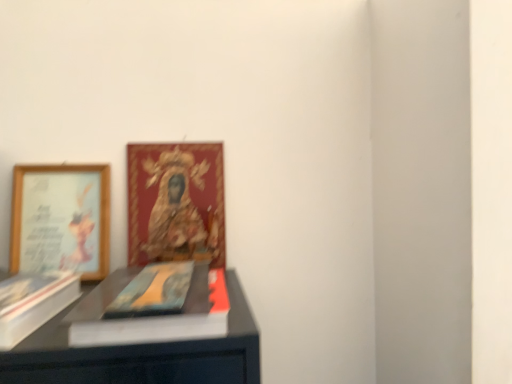
Question: Is gold-framed picture at upper left, which is the 2th picture frame from left to right, facing away from white matte paperback book at left?

Choices:
 (A) yes
 (B) no

Answer: (B)

Question: Could you tell me if gold-framed picture at upper left, which is the 2th picture frame from left to right, is turned towards white matte paperback book at left?

Choices:
 (A) no
 (B) yes

Answer: (A)

Question: Is gold-framed picture at upper left, which is the 2th picture frame from left to right, next to white matte paperback book at left?

Choices:
 (A) no
 (B) yes

Answer: (A)

Question: Is gold-framed picture at upper left, which appears as the first picture frame when viewed from the right, closer to camera compared to white matte paperback book at left?

Choices:
 (A) no
 (B) yes

Answer: (A)

Question: Is gold-framed picture at upper left, which is the 2th picture frame from left to right, far from white matte paperback book at left?

Choices:
 (A) yes
 (B) no

Answer: (B)

Question: From a real-world perspective, is gold-framed picture at upper left, which is the 2th picture frame from left to right, located higher than white matte paperback book at left?

Choices:
 (A) yes
 (B) no

Answer: (A)

Question: Considering the relative positions of gold-framed picture at upper left, which appears as the first picture frame when viewed from the right, and wooden framed picture at left, which appears as the second picture frame when viewed from the right, in the image provided, is gold-framed picture at upper left, which appears as the first picture frame when viewed from the right, to the right of wooden framed picture at left, which appears as the second picture frame when viewed from the right, from the viewer's perspective?

Choices:
 (A) no
 (B) yes

Answer: (B)

Question: From a real-world perspective, is gold-framed picture at upper left, which appears as the first picture frame when viewed from the right, located higher than wooden framed picture at left, which appears as the second picture frame when viewed from the right?

Choices:
 (A) no
 (B) yes

Answer: (B)

Question: Are gold-framed picture at upper left, which is the 2th picture frame from left to right, and wooden framed picture at left, the first picture frame viewed from the left, far apart?

Choices:
 (A) no
 (B) yes

Answer: (A)

Question: Considering the relative positions of gold-framed picture at upper left, which appears as the first picture frame when viewed from the right, and wooden framed picture at left, which appears as the second picture frame when viewed from the right, in the image provided, is gold-framed picture at upper left, which appears as the first picture frame when viewed from the right, to the left of wooden framed picture at left, which appears as the second picture frame when viewed from the right, from the viewer's perspective?

Choices:
 (A) no
 (B) yes

Answer: (A)

Question: Can you confirm if gold-framed picture at upper left, which appears as the first picture frame when viewed from the right, is smaller than wooden framed picture at left, which appears as the second picture frame when viewed from the right?

Choices:
 (A) yes
 (B) no

Answer: (A)

Question: From a real-world perspective, is gold-framed picture at upper left, which appears as the first picture frame when viewed from the right, below wooden framed picture at left, which appears as the second picture frame when viewed from the right?

Choices:
 (A) yes
 (B) no

Answer: (B)

Question: Does matte blue book at center have a larger size compared to white matte paperback book at left?

Choices:
 (A) no
 (B) yes

Answer: (A)